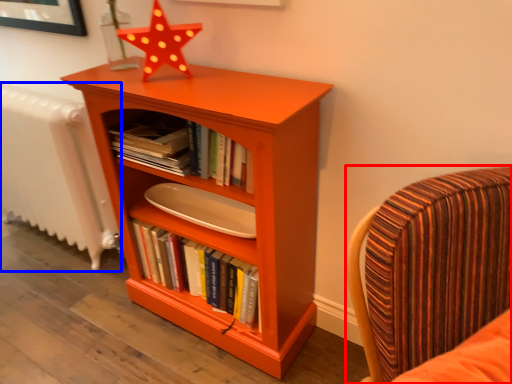
Question: Which of the following is the closest to the observer, chair (highlighted by a red box) or radiator (highlighted by a blue box)?

Choices:
 (A) chair
 (B) radiator

Answer: (A)